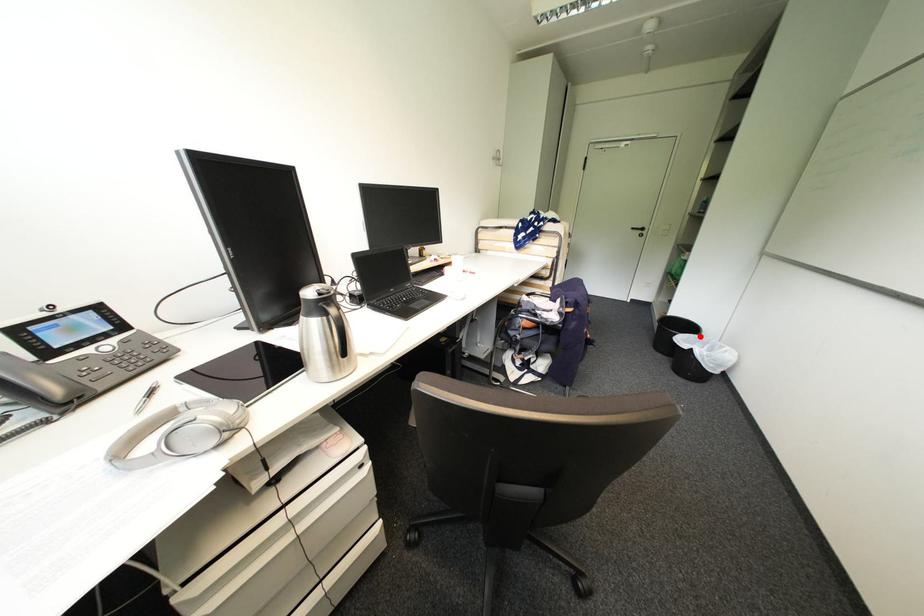
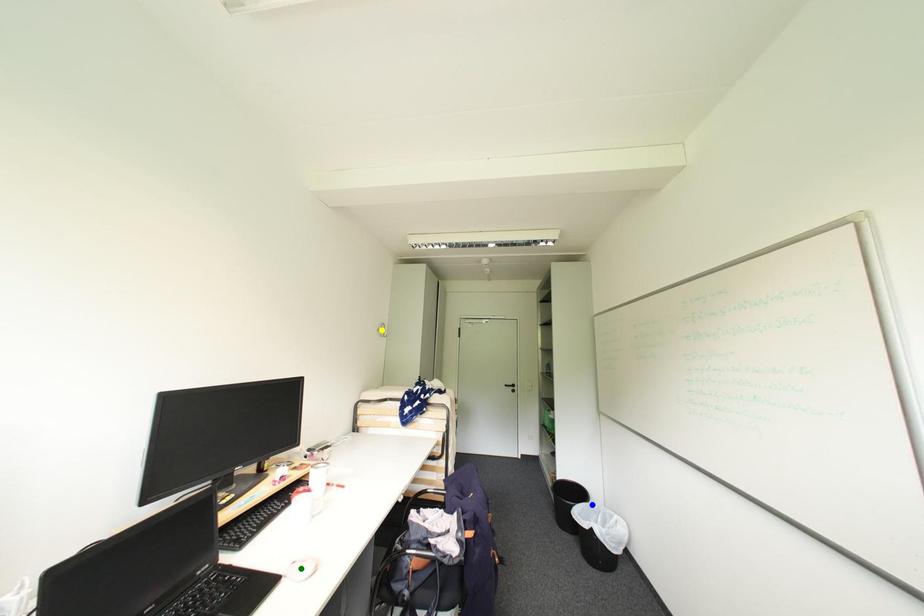
Question: I am providing you with two images of the same scene from different viewpoints. A red point is marked on the first image. You are given multiple points on the second image. Can you choose the point in image 2 that corresponds to the point in image 1?

Choices:
 (A) yellow point
 (B) blue point
 (C) green point

Answer: (B)